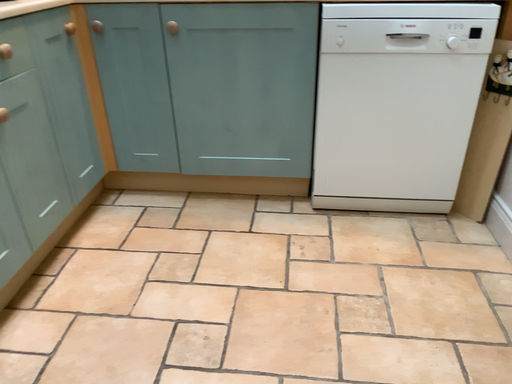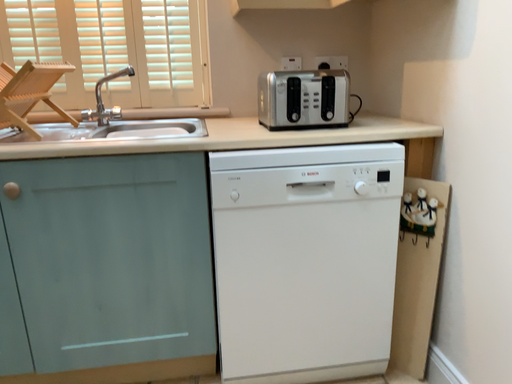
Question: Which way did the camera rotate in the video?

Choices:
 (A) rotated upward
 (B) rotated downward

Answer: (A)